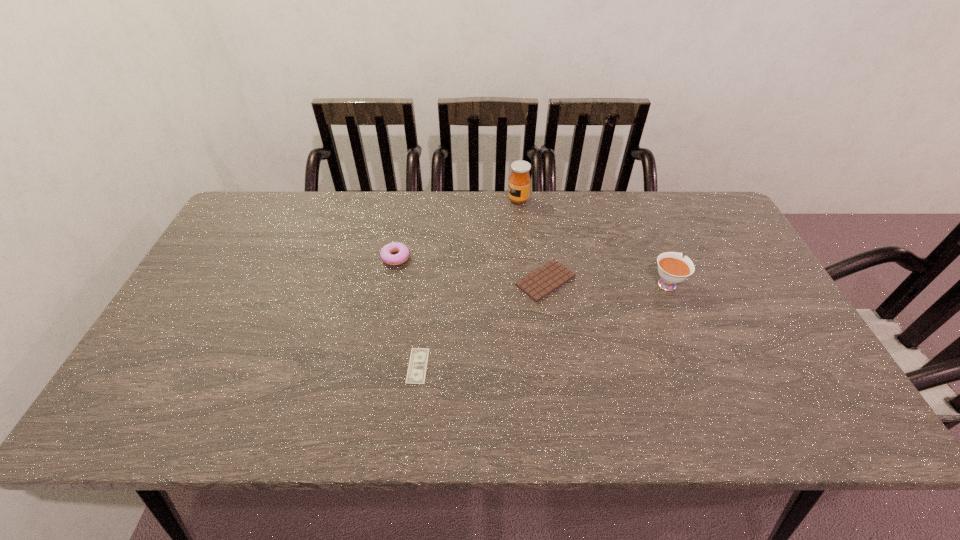
At what (x,y) coordinates should I click in order to perform the action: click on free point between the nearest object and the tallest object. Please return your answer as a coordinate pair (x, y). The height and width of the screenshot is (540, 960). Looking at the image, I should click on (468, 282).

Locate an element on the screen. The height and width of the screenshot is (540, 960). vacant point located between the chocolate bar and the rightmost object is located at coordinates (606, 282).

Identify the location of free spot between the teacup and the honey. The image size is (960, 540). (592, 241).

You are a GUI agent. You are given a task and a screenshot of the screen. Output one action in this format:
    pyautogui.click(x=<x>, y=<y>)
    Task: Click on the vacant area that lies between the teacup and the farthest object
    The height and width of the screenshot is (540, 960).
    Given the screenshot: What is the action you would take?
    pyautogui.click(x=592, y=241)

Locate an element on the screen. This screenshot has width=960, height=540. empty location between the honey and the second shortest object is located at coordinates (532, 240).

I want to click on vacant area between the chocolate bar and the leftmost object, so click(470, 269).

Identify which object is the fourth nearest to the teacup. Please provide its 2D coordinates. Your answer should be formatted as a tuple, i.e. [(x, y)], where the tuple contains the x and y coordinates of a point satisfying the conditions above.

[(386, 253)]

Select which object appears as the fourth closest to the teacup. Please provide its 2D coordinates. Your answer should be formatted as a tuple, i.e. [(x, y)], where the tuple contains the x and y coordinates of a point satisfying the conditions above.

[(386, 253)]

I want to click on vacant space that satisfies the following two spatial constraints: 1. on the side of the rightmost object with the handle; 2. on the front-facing side of the farthest object, so click(633, 200).

Locate an element on the screen. Image resolution: width=960 pixels, height=540 pixels. free point that satisfies the following two spatial constraints: 1. on the side of the fourth shortest object with the handle; 2. on the front-facing side of the honey is located at coordinates (633, 200).